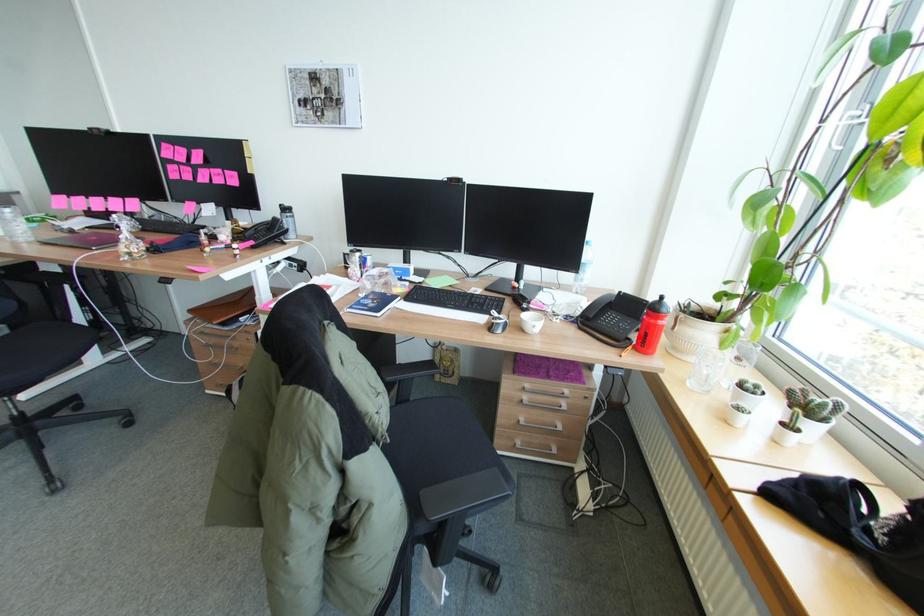
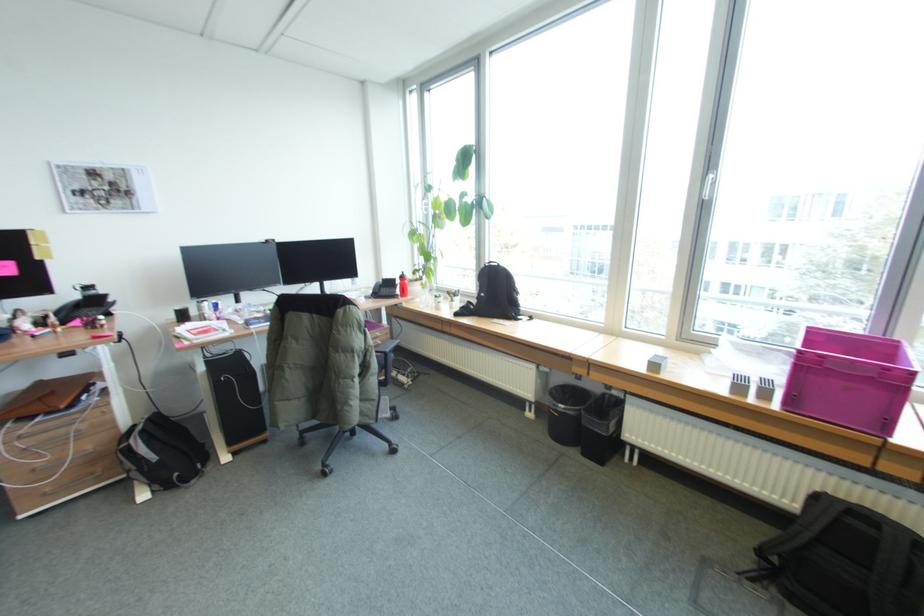
Find the pixel in the second image that matches the highlighted location in the first image.

(403, 292)